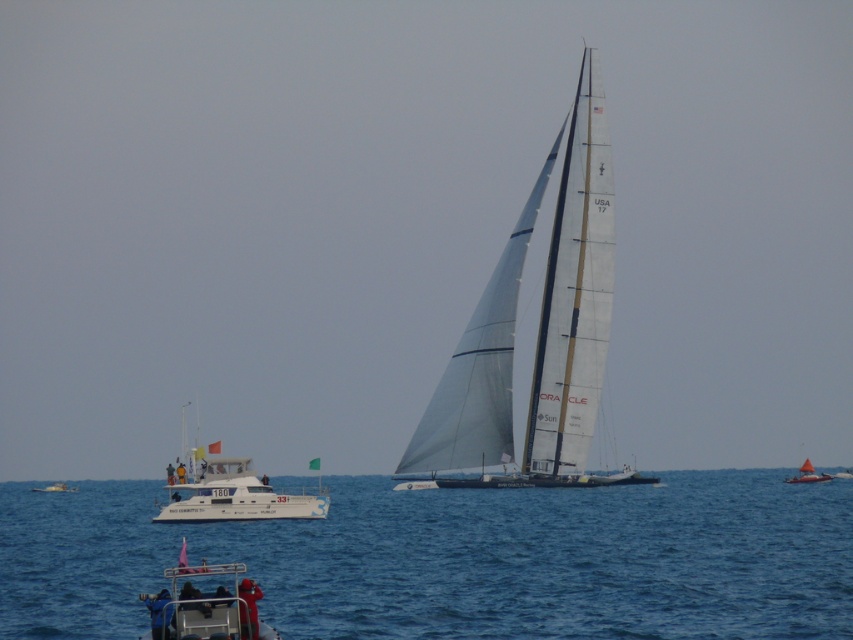
You are a lifeguard on duty and need to assess the visibility of the bright orange sailboat at right and the white plastic boat at lower left from the shore. Based on their colors and positions, which boat would be easier to spot?

The bright orange sailboat at right would be easier to spot because its color contrasts more with the surrounding water and sky compared to the white plastic boat at lower left.

You are a photographer positioned at the center of the image. You want to capture both the white matte yacht at lower left and the metallic gray boat at lower left in your shot. Based on their positions, which boat should you pan your camera to the left to include first?

The white matte yacht at lower left is to the left of the metallic gray boat at lower left, so you should pan your camera to the left first to include the white matte yacht at lower left before adjusting to capture the metallic gray boat at lower left.